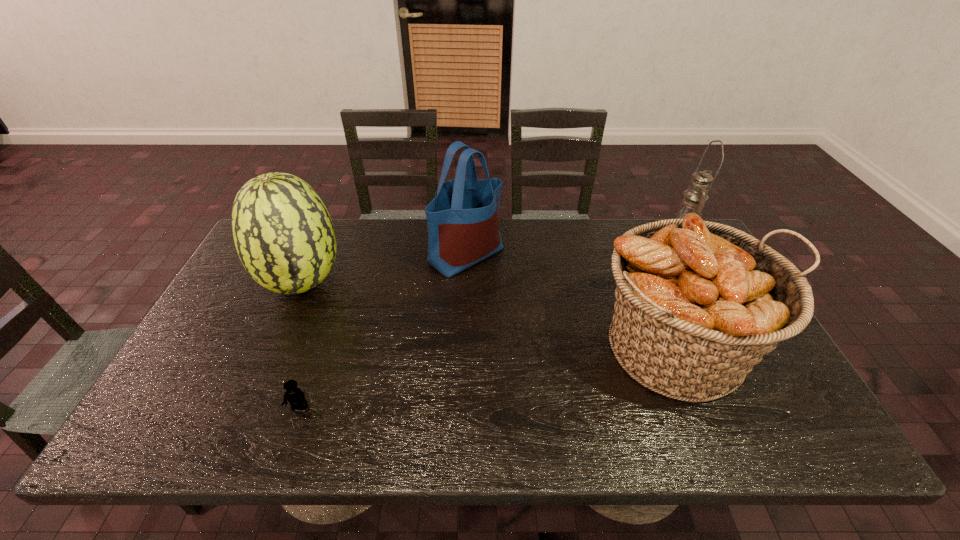
Locate an element on the screen. Image resolution: width=960 pixels, height=540 pixels. oil lamp that is at the far edge is located at coordinates (695, 196).

This screenshot has width=960, height=540. I want to click on watermelon present at the far edge, so click(283, 233).

Locate an element on the screen. The width and height of the screenshot is (960, 540). basket that is at the near edge is located at coordinates (698, 304).

Where is `Lego located in the near edge section of the desktop`? The image size is (960, 540). Lego located in the near edge section of the desktop is located at coordinates (296, 398).

Image resolution: width=960 pixels, height=540 pixels. Find the location of `object positioned at the left edge`. object positioned at the left edge is located at coordinates click(283, 233).

The width and height of the screenshot is (960, 540). Identify the location of oil lamp situated at the right edge. (695, 196).

Where is `basket that is at the right edge`? Image resolution: width=960 pixels, height=540 pixels. basket that is at the right edge is located at coordinates (698, 304).

Locate an element on the screen. object that is at the far left corner is located at coordinates pos(283,233).

Identify the location of object at the far right corner. The image size is (960, 540). (695, 196).

Identify the location of object located at the near right corner. The height and width of the screenshot is (540, 960). (698, 304).